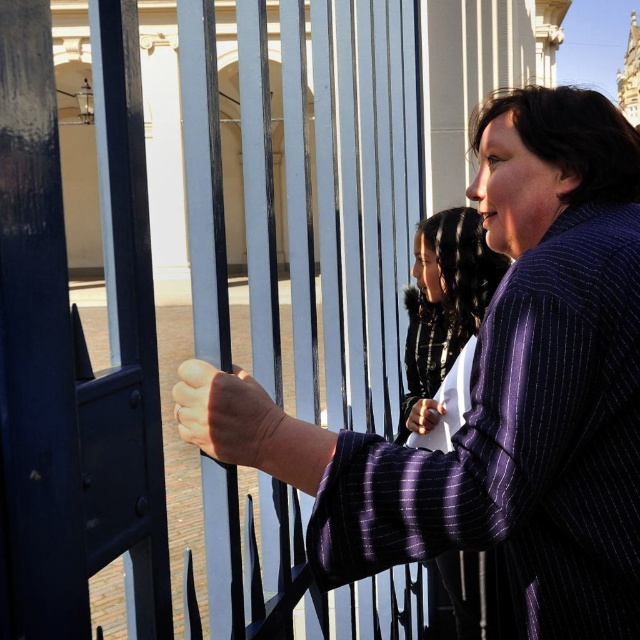
Question: Is purple pinstripe robe at right smaller than pinstriped wool coat at center?

Choices:
 (A) no
 (B) yes

Answer: (B)

Question: Does purple pinstripe robe at right have a smaller size compared to pinstriped wool coat at center?

Choices:
 (A) no
 (B) yes

Answer: (B)

Question: Among these objects, which one is nearest to the camera?

Choices:
 (A) pinstriped wool coat at center
 (B) purple pinstripe robe at right

Answer: (B)

Question: Can you confirm if purple pinstripe robe at right is smaller than pinstriped wool coat at center?

Choices:
 (A) yes
 (B) no

Answer: (A)

Question: Which point is closer to the camera?

Choices:
 (A) purple pinstripe robe at right
 (B) pinstriped wool coat at center

Answer: (A)